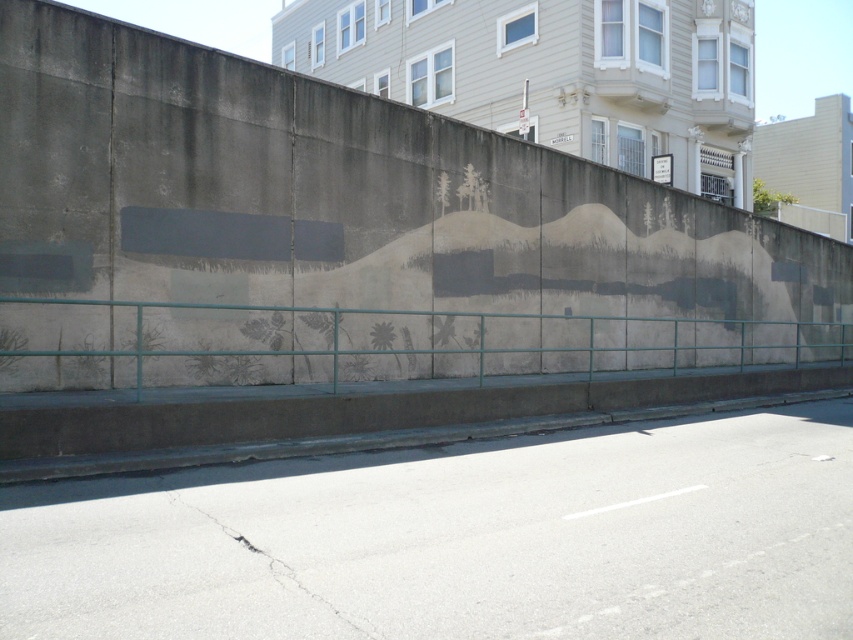
Which is above, concrete wall at center or teal metal fence at lower center?

concrete wall at center

Between point (605, 339) and point (15, 312), which one is positioned behind?

Positioned behind is point (605, 339).

Measure the distance between point (782, 305) and camera.

A distance of 22.92 meters exists between point (782, 305) and camera.

I want to click on concrete wall at center, so click(346, 234).

Which is behind, point (790, 560) or point (752, 324)?

Positioned behind is point (752, 324).

At what (x,y) coordinates should I click in order to perform the action: click on gray asphalt pavement at lower center. Please return your answer as a coordinate pair (x, y). The width and height of the screenshot is (853, 640). Looking at the image, I should click on (457, 540).

Does concrete wall at center appear on the right side of gray asphalt pavement at lower center?

Correct, you'll find concrete wall at center to the right of gray asphalt pavement at lower center.

Who is taller, concrete wall at center or gray asphalt pavement at lower center?

Standing taller between the two is concrete wall at center.

Does point (154, 118) lie in front of point (257, 513)?

No, (154, 118) is behind (257, 513).

This screenshot has width=853, height=640. I want to click on concrete wall at center, so click(346, 234).